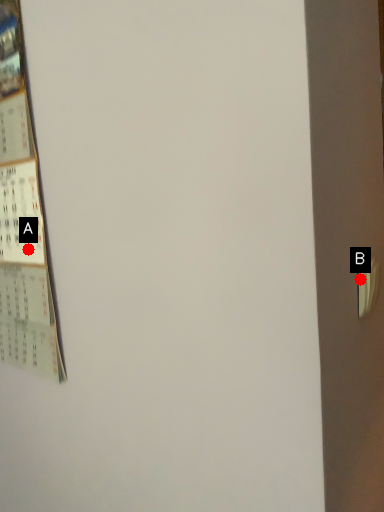
Question: Two points are circled on the image, labeled by A and B beside each circle. Which point is farther from the camera taking this photo?

Choices:
 (A) A is further
 (B) B is further

Answer: (A)